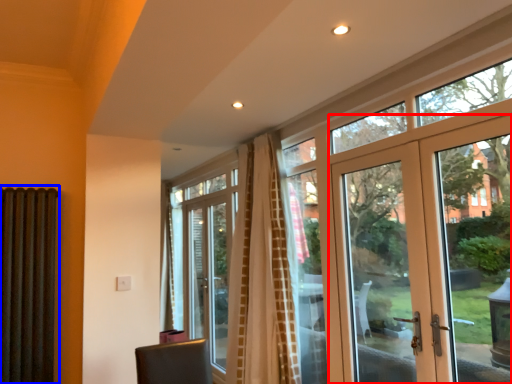
Question: Which point is closer to the camera, door (highlighted by a red box) or shutter (highlighted by a blue box)?

Choices:
 (A) door
 (B) shutter

Answer: (A)